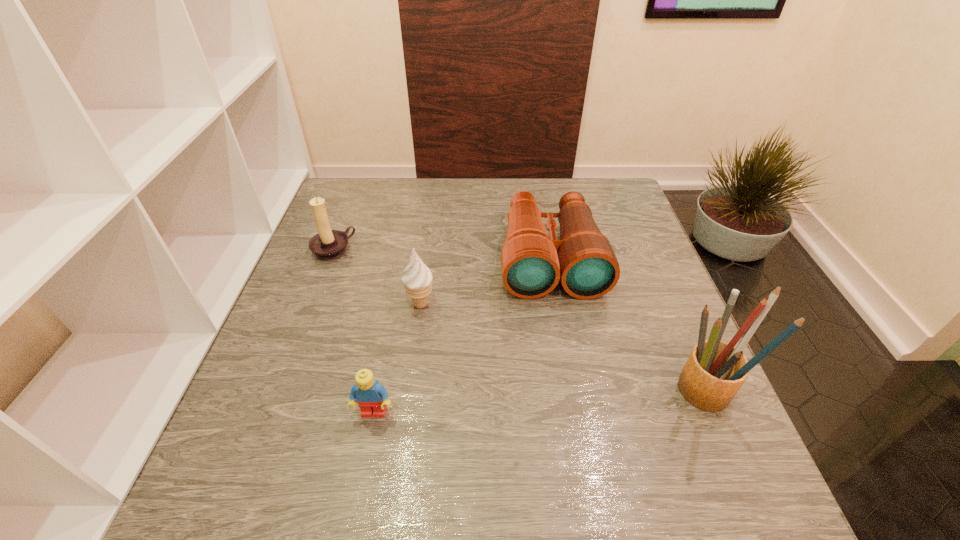
Identify the location of vacant space on the desktop that is between the shortest object and the pencil box and is positioned on the wick of the leftmost object. The image size is (960, 540). (510, 405).

Where is `free spot on the desktop that is between the shortest object and the tallest object and is positioned through the lenses of the second object from right to left`? The height and width of the screenshot is (540, 960). free spot on the desktop that is between the shortest object and the tallest object and is positioned through the lenses of the second object from right to left is located at coordinates (573, 401).

Identify the location of free space on the desktop that is between the shortest object and the rightmost object and is positioned on the front-facing side of the icecream. This screenshot has height=540, width=960. pyautogui.click(x=590, y=400).